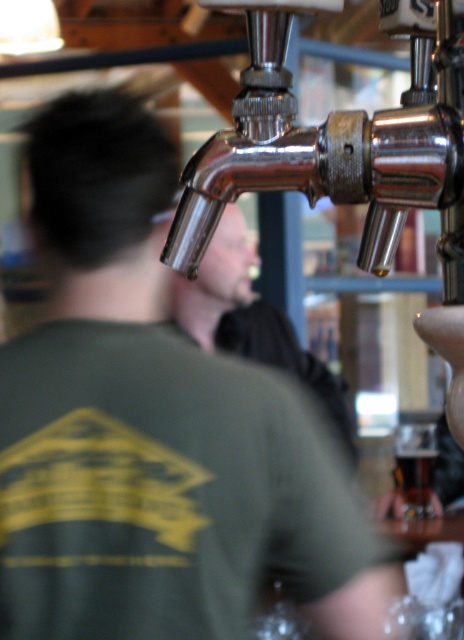
Question: Based on their relative distances, which object is farther from the chrome metallic faucet at upper center?

Choices:
 (A) translucent glass at center
 (B) shiny metallic faucet at center

Answer: (A)

Question: Does chrome metallic faucet at upper center have a smaller size compared to translucent glass at center?

Choices:
 (A) no
 (B) yes

Answer: (A)

Question: Can you confirm if chrome metallic faucet at upper center is positioned below translucent glass at center?

Choices:
 (A) no
 (B) yes

Answer: (A)

Question: Does chrome metallic faucet at upper center appear on the left side of translucent glass at center?

Choices:
 (A) yes
 (B) no

Answer: (A)

Question: Which of the following is the closest to the observer?

Choices:
 (A) (223, 284)
 (B) (461, 35)
 (C) (421, 451)

Answer: (B)

Question: Which of the following is the closest to the observer?

Choices:
 (A) (245, 278)
 (B) (431, 458)
 (C) (391, 184)

Answer: (C)